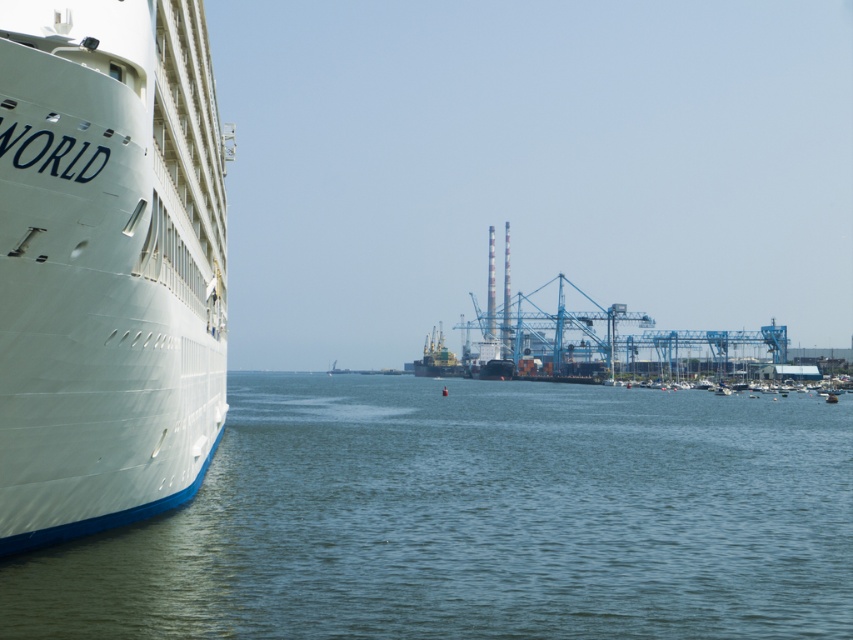
Which is behind, point (64, 394) or point (421, 371)?

Positioned behind is point (421, 371).

From the picture: Between white glossy cruise ship at left and metallic gray ship at center, which one is positioned lower?

Positioned lower is metallic gray ship at center.

At what (x,y) coordinates should I click in order to perform the action: click on white glossy cruise ship at left. Please return your answer as a coordinate pair (x, y). Image resolution: width=853 pixels, height=640 pixels. Looking at the image, I should click on (107, 262).

Where is `clear blue water at lower left`? The image size is (853, 640). clear blue water at lower left is located at coordinates (476, 518).

Does clear blue water at lower left appear over metallic gray ship at center?

No, clear blue water at lower left is not above metallic gray ship at center.

I want to click on clear blue water at lower left, so click(x=476, y=518).

Is clear blue water at lower left to the left of white glossy cruise ship at left from the viewer's perspective?

Incorrect, clear blue water at lower left is not on the left side of white glossy cruise ship at left.

Measure the distance between clear blue water at lower left and camera.

They are 16.40 meters apart.

Where is `clear blue water at lower left`? The height and width of the screenshot is (640, 853). clear blue water at lower left is located at coordinates [x=476, y=518].

At what (x,y) coordinates should I click in order to perform the action: click on clear blue water at lower left. Please return your answer as a coordinate pair (x, y). Image resolution: width=853 pixels, height=640 pixels. Looking at the image, I should click on (476, 518).